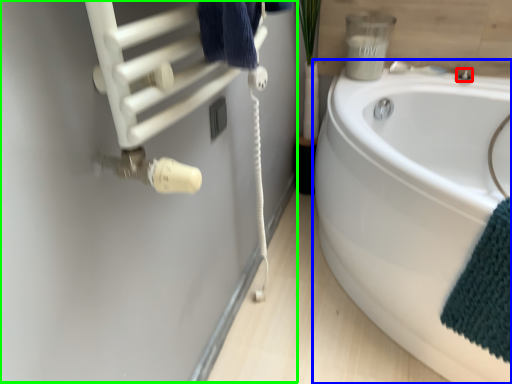
Question: Based on their relative distances, which object is nearer to faucet (highlighted by a red box)? Choose from bathtub (highlighted by a blue box) and wool (highlighted by a green box).

Choices:
 (A) bathtub
 (B) wool

Answer: (A)